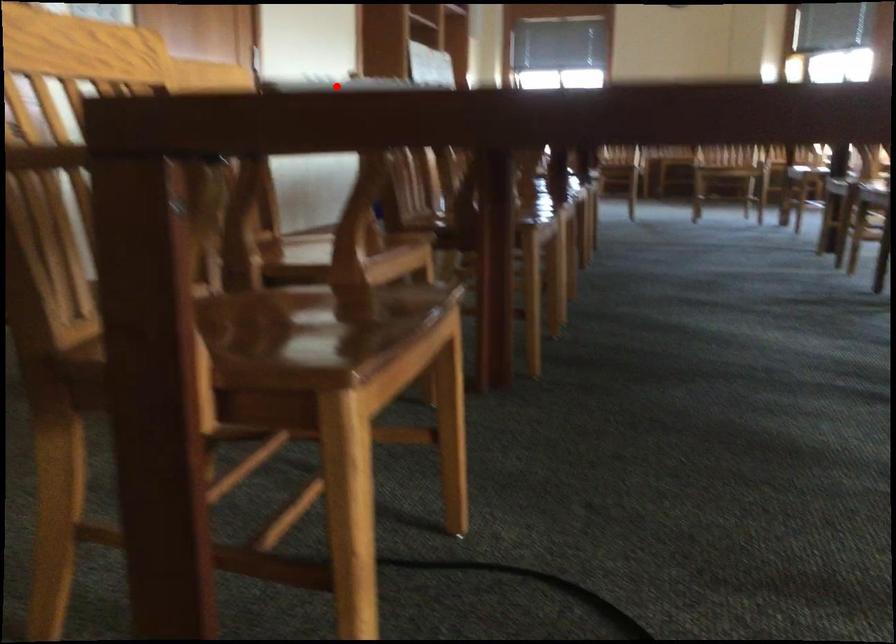
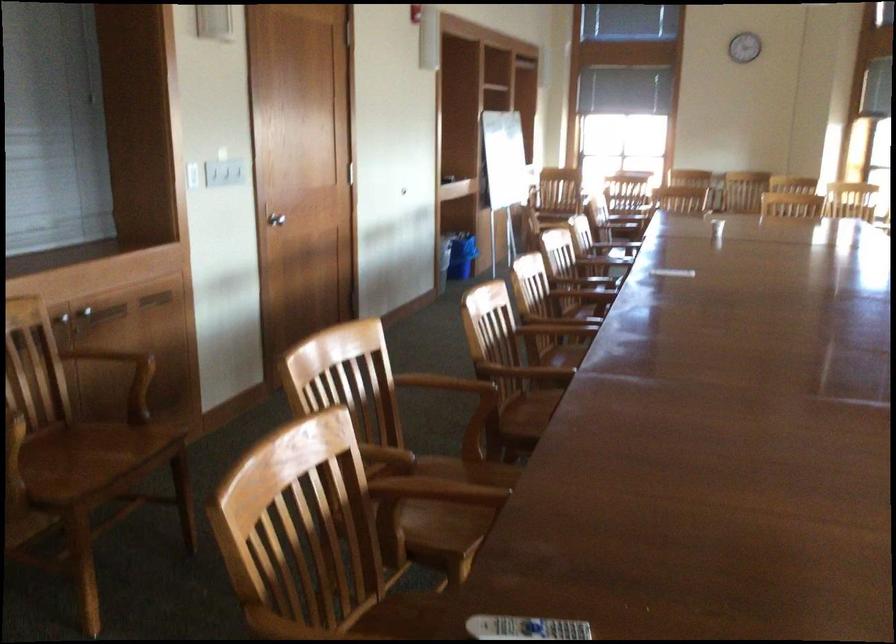
Question: I am providing you with two images of the same scene from different viewpoints. Given a red point in image1, look at the same physical point in image2. Is it:

Choices:
 (A) Closer to the viewpoint
 (B) Farther from the viewpoint

Answer: (B)